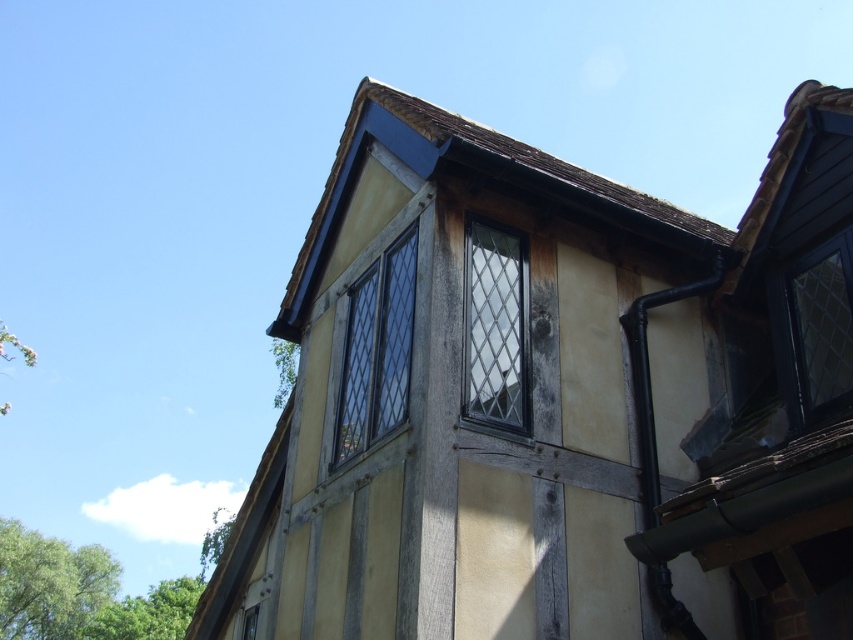
You are an architect examining the traditional half timbered building. You notice the clear glass window at upper center and the matte black window at center. Which window is located to the left of the other?

The clear glass window at upper center is positioned on the left side of matte black window at center.

Consider the image. You are an architect examining the facade of a traditional half timbered building. You notice two windows, the clear glass window at upper center and the matte black window at center. Which window is positioned higher up on the building?

The matte black window at center is positioned higher up on the building because the clear glass window at upper center is located below it.